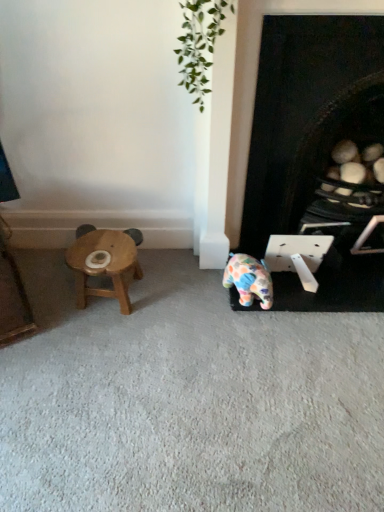
Question: Can you confirm if black matte fireplace at lower right is bigger than wooden stool at left?

Choices:
 (A) yes
 (B) no

Answer: (A)

Question: Is black matte fireplace at lower right at the left side of wooden stool at left?

Choices:
 (A) no
 (B) yes

Answer: (A)

Question: Does black matte fireplace at lower right have a greater width compared to wooden stool at left?

Choices:
 (A) no
 (B) yes

Answer: (B)

Question: From a real-world perspective, is black matte fireplace at lower right under wooden stool at left?

Choices:
 (A) yes
 (B) no

Answer: (B)

Question: Does black matte fireplace at lower right appear on the right side of wooden stool at left?

Choices:
 (A) no
 (B) yes

Answer: (B)

Question: Would you say wooden stool at left is to the left or to the right of black matte fireplace at lower right in the picture?

Choices:
 (A) right
 (B) left

Answer: (B)

Question: Is point (109, 291) positioned closer to the camera than point (352, 271)?

Choices:
 (A) closer
 (B) farther

Answer: (A)

Question: From a real-world perspective, is wooden stool at left above or below black matte fireplace at lower right?

Choices:
 (A) above
 (B) below

Answer: (B)

Question: In the image, is wooden stool at left positioned in front of or behind black matte fireplace at lower right?

Choices:
 (A) front
 (B) behind

Answer: (B)

Question: Does point (334, 51) appear closer or farther from the camera than point (87, 261)?

Choices:
 (A) closer
 (B) farther

Answer: (A)

Question: Do you think black matte fireplace at lower right is within wooden stool at left, or outside of it?

Choices:
 (A) outside
 (B) inside

Answer: (A)

Question: Considering their positions, is black matte fireplace at lower right located in front of or behind wooden stool at left?

Choices:
 (A) behind
 (B) front

Answer: (B)

Question: From their relative heights in the image, would you say black matte fireplace at lower right is taller or shorter than wooden stool at left?

Choices:
 (A) tall
 (B) short

Answer: (A)

Question: Is polka dot ceramic elephant at center taller or shorter than wooden stool at left?

Choices:
 (A) tall
 (B) short

Answer: (B)

Question: In the image, is polka dot ceramic elephant at center on the left side or the right side of wooden stool at left?

Choices:
 (A) left
 (B) right

Answer: (B)